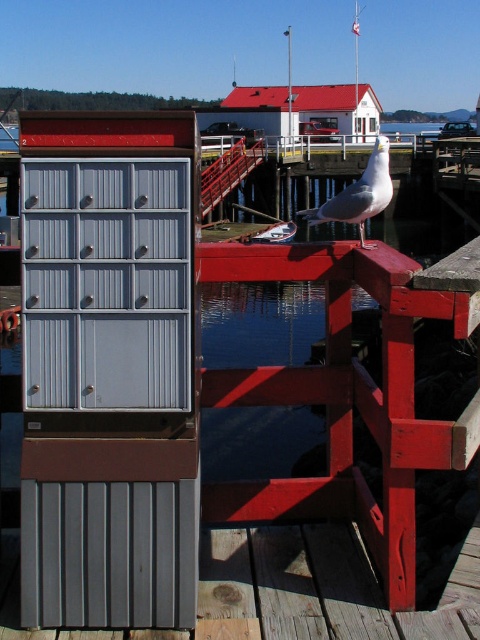
Which of these two, gray plastic drawers at center or white matte seagull at center, stands shorter?

With less height is gray plastic drawers at center.

Is gray plastic drawers at center wider than white matte seagull at center?

In fact, gray plastic drawers at center might be narrower than white matte seagull at center.

Who is more distant from viewer, (86, 230) or (344, 189)?

Positioned behind is point (344, 189).

Find the location of a particular element. gray plastic drawers at center is located at coordinates click(106, 234).

Can you confirm if gray plastic drawers at left is thinner than white matte seagull at center?

Yes.

Can you confirm if gray plastic drawers at left is smaller than white matte seagull at center?

Correct, gray plastic drawers at left occupies less space than white matte seagull at center.

Image resolution: width=480 pixels, height=640 pixels. What are the coordinates of `gray plastic drawers at left` in the screenshot? It's located at (x=106, y=184).

Is point (113, 344) farther from camera compared to point (360, 205)?

No.

The height and width of the screenshot is (640, 480). What do you see at coordinates (107, 360) in the screenshot?
I see `matte gray drawers at center` at bounding box center [107, 360].

Which is behind, point (104, 321) or point (332, 205)?

The point (332, 205) is behind.

Locate an element on the screen. matte gray drawers at center is located at coordinates (107, 360).